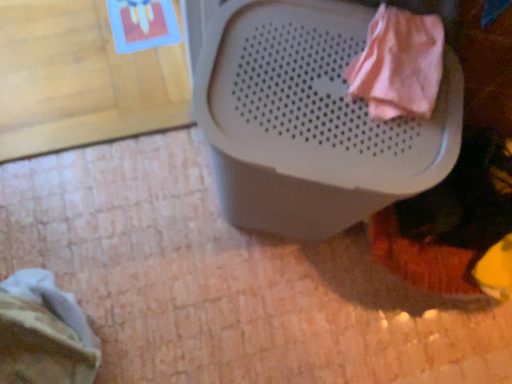
Where is `free location in front of white plastic waste container at upper center`? The image size is (512, 384). free location in front of white plastic waste container at upper center is located at coordinates (253, 313).